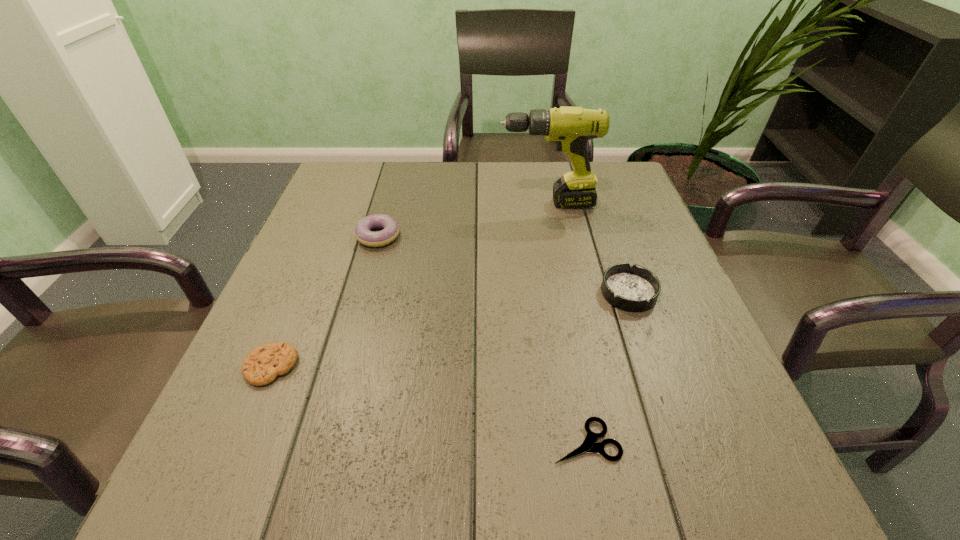
At what (x,y) coordinates should I click in order to perform the action: click on vacant area that lies between the fourth object from right to left and the third nearest object. Please return your answer as a coordinate pair (x, y). Looking at the image, I should click on (503, 264).

Where is `vacant space in between the cookie and the second farthest object`? vacant space in between the cookie and the second farthest object is located at coordinates (324, 301).

What are the coordinates of `unoccupied position between the third nearest object and the second shortest object` in the screenshot? It's located at (450, 329).

The image size is (960, 540). Find the location of `unoccupied area between the third shortest object and the doughnut`. unoccupied area between the third shortest object and the doughnut is located at coordinates (503, 264).

The image size is (960, 540). Find the location of `free space that is in between the leftmost object and the third farthest object`. free space that is in between the leftmost object and the third farthest object is located at coordinates (450, 329).

Where is `empty space between the shortest object and the third tallest object`? This screenshot has width=960, height=540. empty space between the shortest object and the third tallest object is located at coordinates (607, 367).

Where is `free point between the ashtray and the doughnut`? This screenshot has width=960, height=540. free point between the ashtray and the doughnut is located at coordinates (503, 264).

Where is `free spot between the third shortest object and the shortest object`? The image size is (960, 540). free spot between the third shortest object and the shortest object is located at coordinates (607, 367).

The image size is (960, 540). I want to click on vacant area that lies between the second nearest object and the tallest object, so click(x=408, y=285).

At what (x,y) coordinates should I click in order to perform the action: click on object identified as the second closest to the nearest object. Please return your answer as a coordinate pair (x, y). The height and width of the screenshot is (540, 960). Looking at the image, I should click on (262, 365).